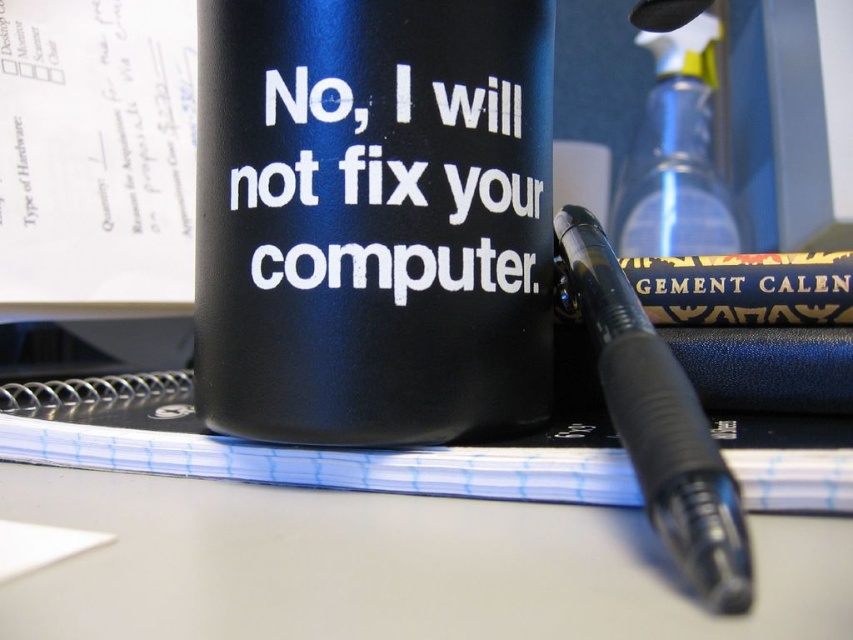
Based on the photo, you are organizing items on your desk and need to place the black plastic pen at center and the transparent plastic spray bottle at upper right into a drawer. The drawer has a height limit of 10 cm. Can both items fit vertically without exceeding the drawer height?

The black plastic pen at center has a lesser height compared to transparent plastic spray bottle at upper right. Since the spray bottle is taller, it might exceed the 10 cm height limit. The pen can fit, but the spray bottle might not. Therefore, both items cannot be guaranteed to fit vertically in the drawer.

You are organizing items on a desk and need to stack the black matte mug at center and the black plastic pen at center vertically. Which item should you place at the bottom to ensure stability?

The black matte mug at center should be placed at the bottom since it has a greater height than the black plastic pen at center, providing a more stable base.

You are organizing the desk and need to place the black plastic pen at center and the transparent plastic spray bottle at upper right. According to their positions, which object is closer to you?

The black plastic pen at center is closer to you because it is positioned under the transparent plastic spray bottle at upper right, indicating it is in front spatially.